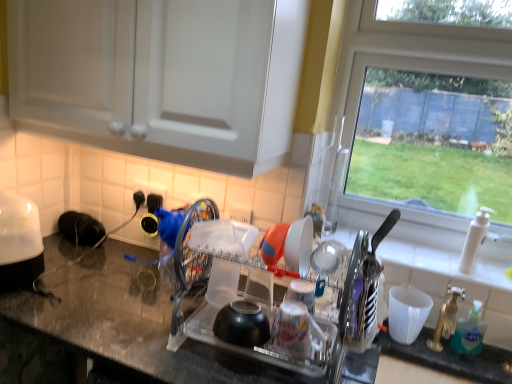
Image resolution: width=512 pixels, height=384 pixels. Find the location of `vacant space behind white plastic faucet at right`. vacant space behind white plastic faucet at right is located at coordinates (432, 253).